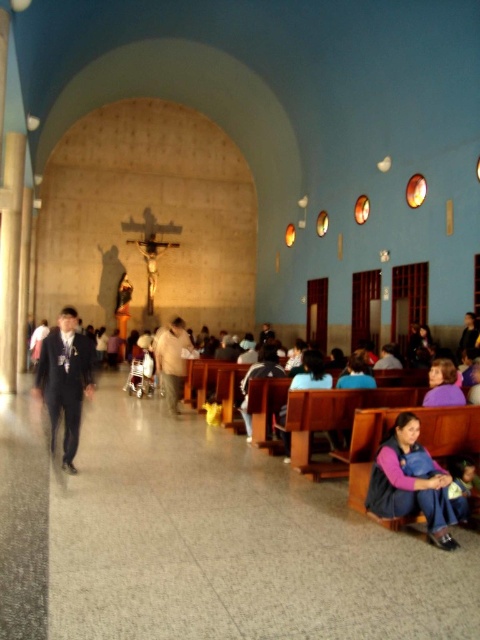
You are standing at the entrance of the church and notice two items at the lower right corner of the image. Which one is bigger between the denim vest at lower right and the purple fabric at lower right?

The denim vest at lower right is larger in size than the purple fabric at lower right.

You are standing at point (427, 403) in the church. You want to walk to the statue of Jesus Christ on the cross located at the far end. Is the point (73, 352) in your path towards the statue?

Yes, point (73, 352) is in your path because it is behind point (427, 403), meaning you would pass through it while moving towards the statue.

You are a visitor entering the church and see the light brown leather jacket at center and the purple fabric at lower right. Which object is bigger in size?

The light brown leather jacket at center is larger in size compared to the purple fabric at lower right.